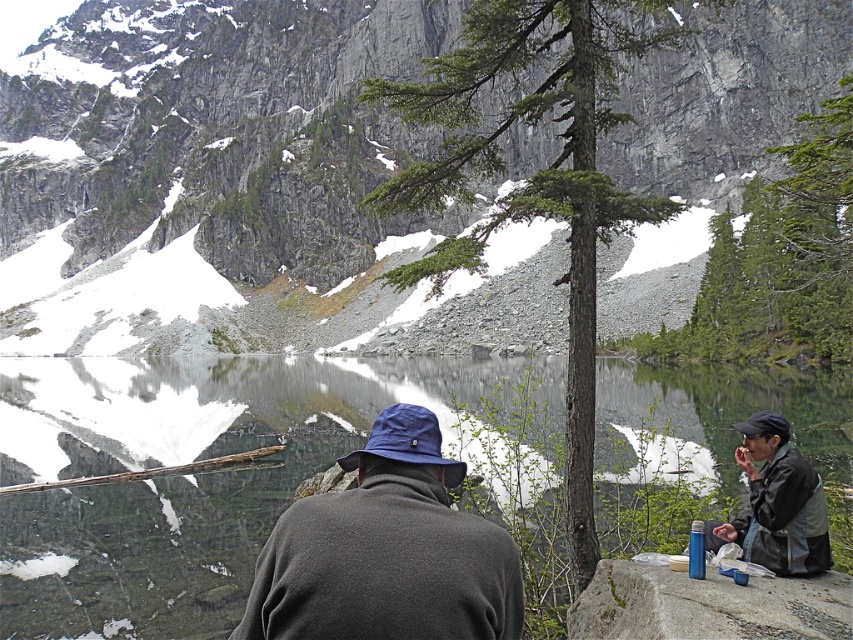
Question: Which point is closer to the camera taking this photo?

Choices:
 (A) (305, 458)
 (B) (575, 625)

Answer: (B)

Question: Does gray rocky mountain at center appear on the right side of dark gray fleece jacket at center?

Choices:
 (A) no
 (B) yes

Answer: (A)

Question: Observing the image, what is the correct spatial positioning of dark gray fleece jacket at center in reference to blue-green rock at lower right?

Choices:
 (A) right
 (B) left

Answer: (B)

Question: Is smooth reflective water at center behind blue-green rock at lower right?

Choices:
 (A) yes
 (B) no

Answer: (A)

Question: Which point is farther from the camera taking this photo?

Choices:
 (A) (437, 440)
 (B) (780, 448)
 (C) (386, 381)
 (D) (660, 593)

Answer: (C)

Question: Estimate the real-world distances between objects in this image. Which object is closer to the gray rocky mountain at center?

Choices:
 (A) dark gray fleece jacket at center
 (B) smooth reflective water at center
 (C) dark gray jacket at lower right

Answer: (B)